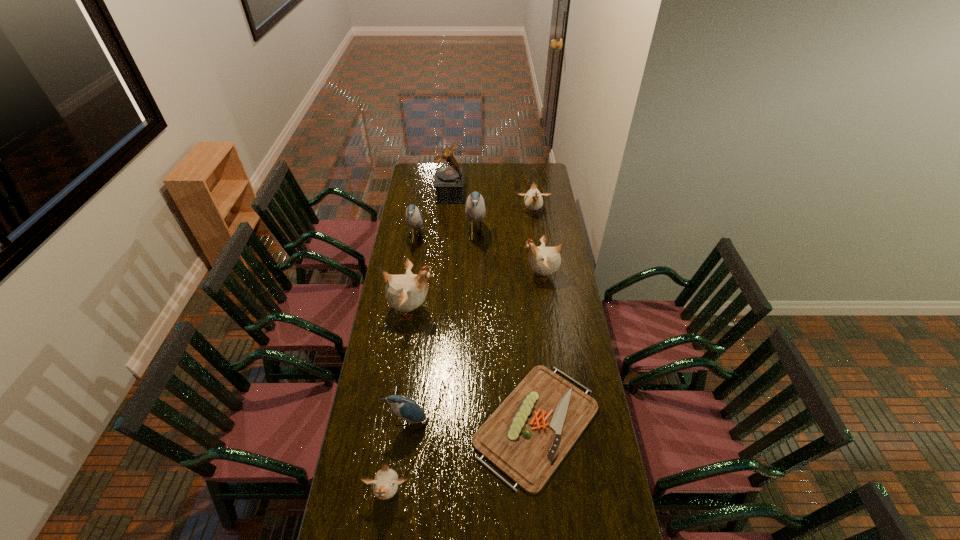
Identify the location of free space located at the tip of the nearest blue bird's beak. (397, 485).

This screenshot has width=960, height=540. I want to click on vacant position located at the beak of the nearest bird, so click(381, 539).

This screenshot has width=960, height=540. I want to click on vacant space located 0.330m on the back of the chopping board, so click(x=525, y=307).

The image size is (960, 540). I want to click on chopping board that is at the right edge, so point(529,434).

You are a GUI agent. You are given a task and a screenshot of the screen. Output one action in this format:
    pyautogui.click(x=<x>, y=<y>)
    Task: Click on the vacant region at the far edge of the desktop
    
    Given the screenshot: What is the action you would take?
    pyautogui.click(x=489, y=175)

Identify the location of vacant space at the left edge of the desktop. This screenshot has height=540, width=960. (401, 240).

I want to click on vacant space at the right edge of the desktop, so click(x=547, y=216).

At what (x,y) coordinates should I click in order to perform the action: click on blank area at the far right corner. Please return your answer as a coordinate pair (x, y). Looking at the image, I should click on (531, 174).

At what (x,y) coordinates should I click in order to perform the action: click on free area in between the biggest blue bird and the farthest white bird. Please return your answer as a coordinate pair (x, y). The width and height of the screenshot is (960, 540). Looking at the image, I should click on (504, 224).

Find the location of a particular element. The image size is (960, 540). free space between the farthest white bird and the third smallest white bird is located at coordinates (537, 244).